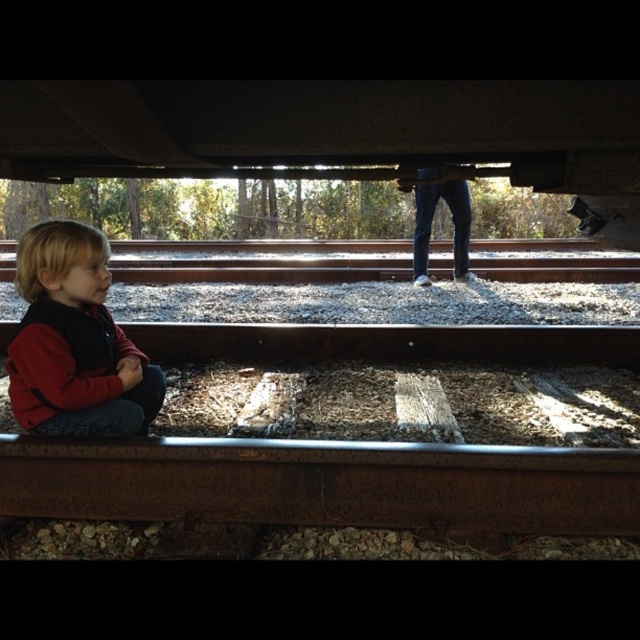
Based on the photo, can you confirm if rusty metal train track at lower center is positioned to the right of red fleece jacket at lower left?

Yes, rusty metal train track at lower center is to the right of red fleece jacket at lower left.

Between rusty metal train track at lower center and red fleece jacket at lower left, which one is positioned lower?

rusty metal train track at lower center is lower down.

Who is more distant from viewer, (200,442) or (49,429)?

Point (49,429)

This screenshot has width=640, height=640. Identify the location of rusty metal train track at lower center. (352, 444).